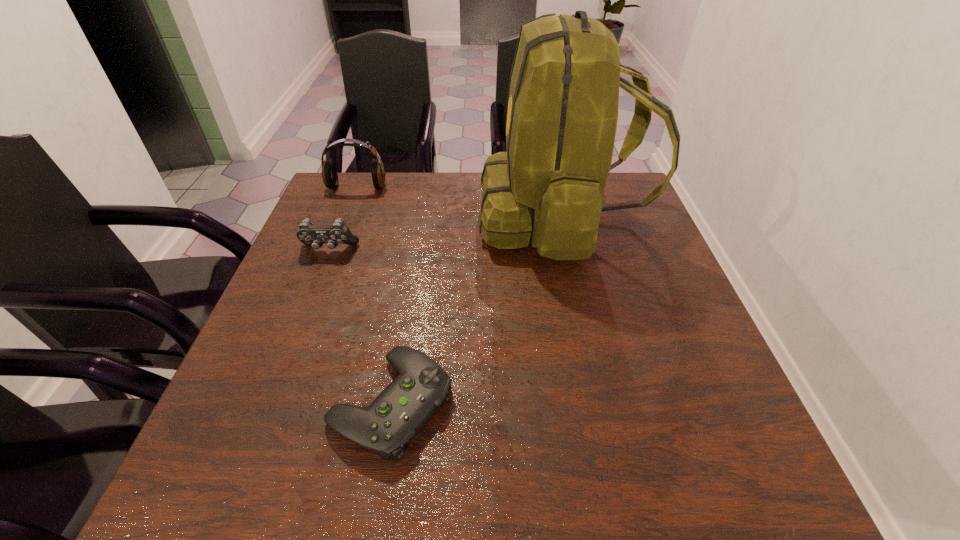
Identify the location of object that is at the far right corner. (562, 111).

This screenshot has width=960, height=540. In the image, there is a desktop. What are the coordinates of `vacant region at the far edge` in the screenshot? It's located at (445, 190).

The image size is (960, 540). I want to click on vacant space at the right edge, so click(x=706, y=345).

I want to click on vacant space at the far left corner of the desktop, so click(x=334, y=212).

Identify the location of free space at the near left corner. The image size is (960, 540). (244, 457).

The width and height of the screenshot is (960, 540). In order to click on free space between the rightmost object and the shorter control in this screenshot , I will do `click(476, 310)`.

What are the coordinates of `unoccupied area between the headset and the tallest object` in the screenshot? It's located at (459, 202).

Find the location of a particular element. The image size is (960, 540). unoccupied area between the third shortest object and the tallest object is located at coordinates (459, 202).

Where is `free spot between the farther control and the nearer control`? This screenshot has height=540, width=960. free spot between the farther control and the nearer control is located at coordinates click(x=360, y=326).

At what (x,y) coordinates should I click in order to perform the action: click on free spot between the rightmost object and the taller control. Please return your answer as a coordinate pair (x, y). Looking at the image, I should click on (444, 233).